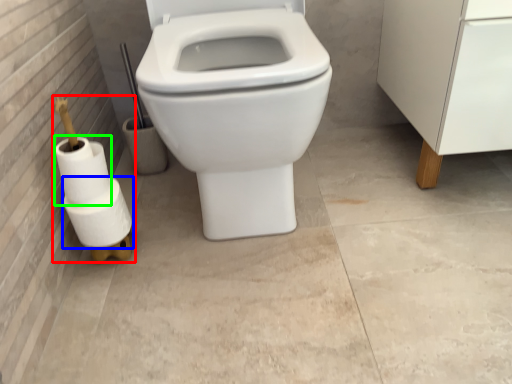
Question: Which object is positioned farthest from toilet paper (highlighted by a red box)? Select from toilet paper (highlighted by a blue box) and toilet paper (highlighted by a green box).

Choices:
 (A) toilet paper
 (B) toilet paper

Answer: (B)